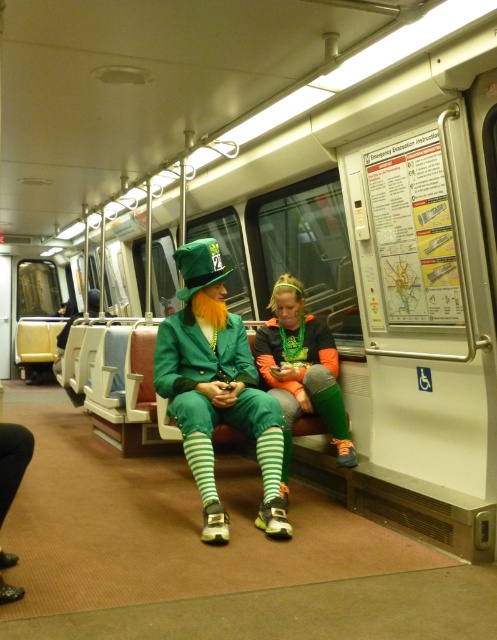
In the scene shown: You are a passenger trying to sit down in the subway car. You see the shiny green suit at center and the neon orange fabric leggings at center. Which object takes up more horizontal space?

The shiny green suit at center might be wider than neon orange fabric leggings at center, so it likely takes up more horizontal space.

You are a passenger in the subway car and want to know which clothing item is closer to you. The items are the shiny green suit at center and the neon orange fabric leggings at center. Can you tell me which one is closer?

The shiny green suit at center is in front of the neon orange fabric leggings at center, so the shiny green suit at center is closer to you.

You are a photographer standing in the subway car and want to take a photo of both the shiny green suit at center and the neon orange fabric leggings at center. The camera you are using has a maximum focus range of 20 inches. Can you capture both subjects in focus without moving the camera?

The shiny green suit at center and neon orange fabric leggings at center are 21.19 inches apart from each other. Since the camera has a maximum focus range of 20 inches, you cannot capture both subjects in focus without moving the camera.